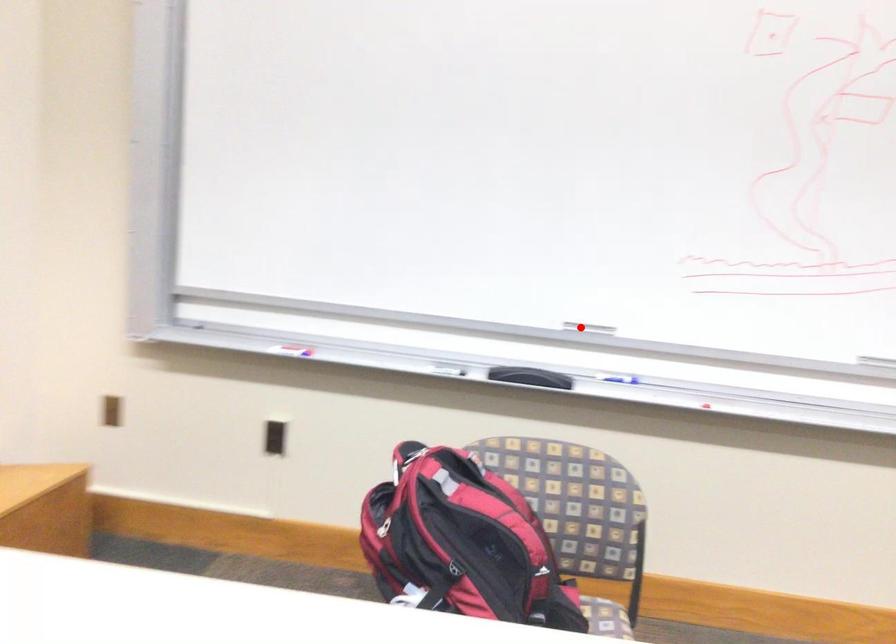
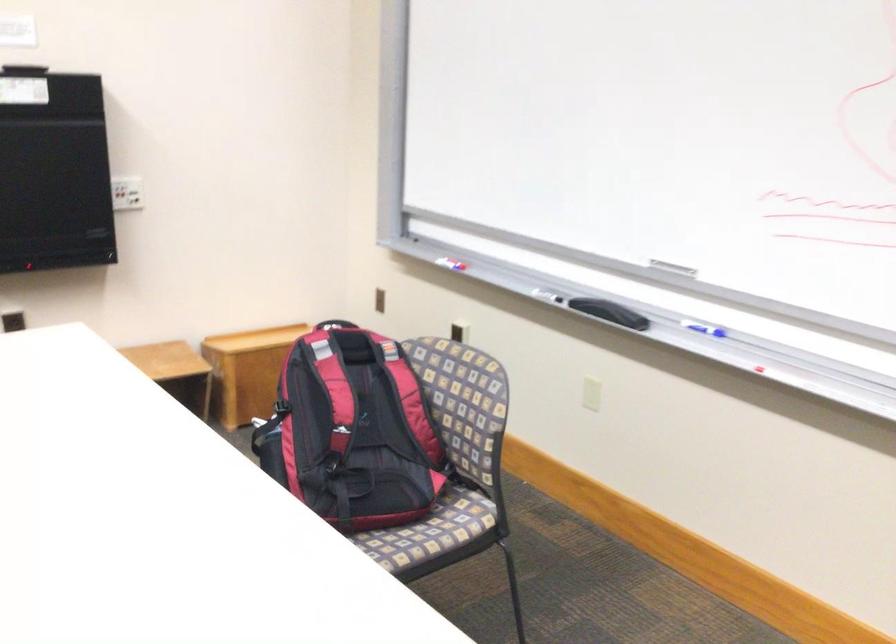
The point at the highlighted location is marked in the first image. Where is the corresponding point in the second image?

(672, 267)